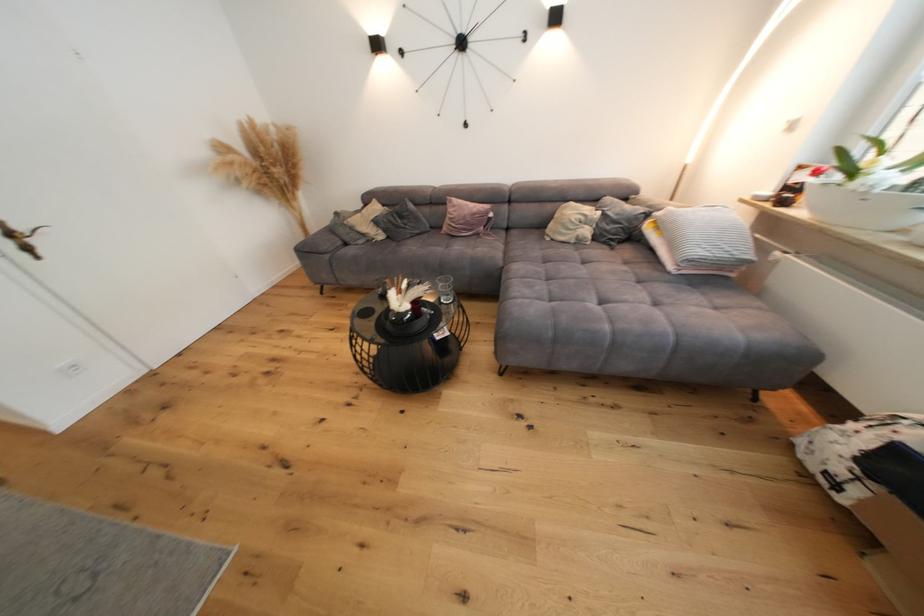
The image size is (924, 616). Describe the element at coordinates (570, 275) in the screenshot. I see `the sofa sitting surface` at that location.